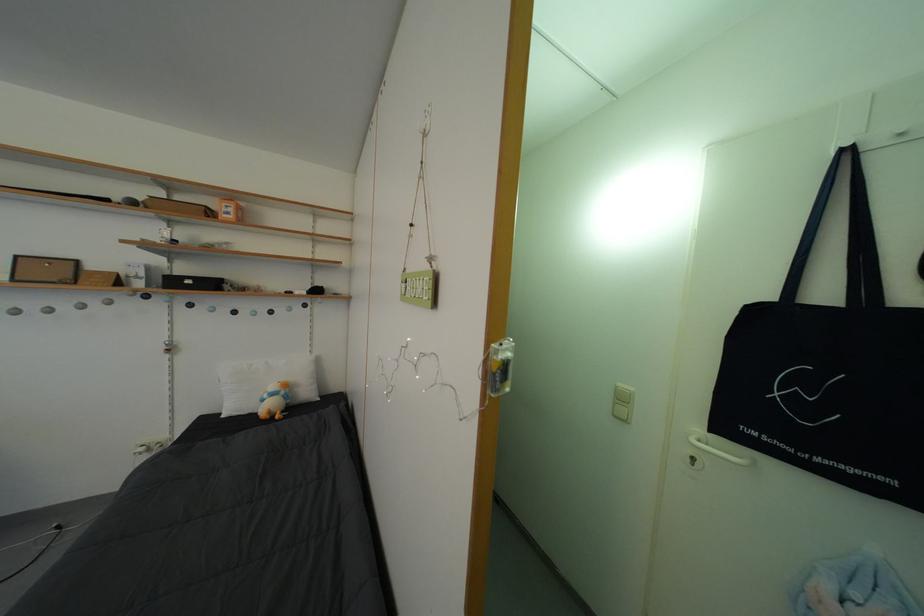
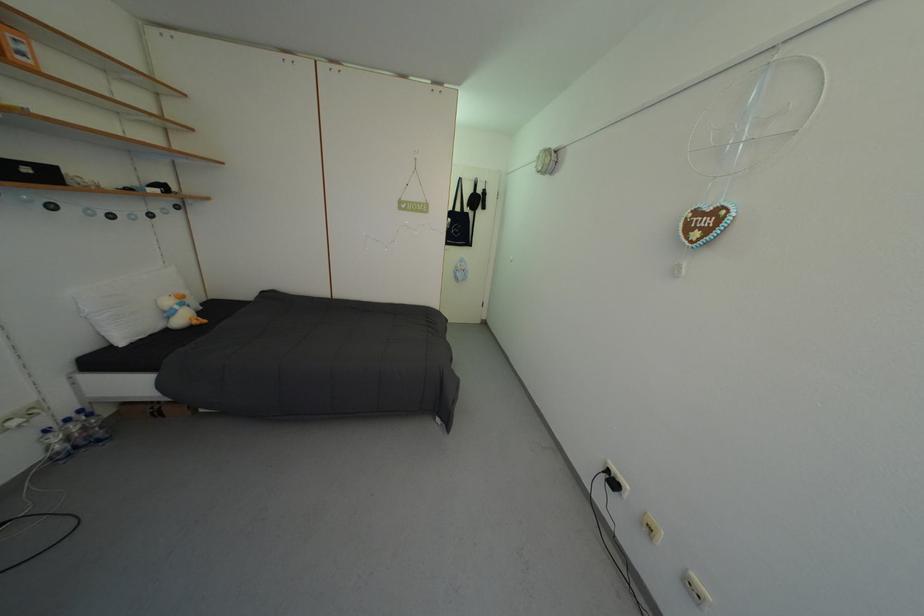
In the second image, find the point that corresponds to [274,400] in the first image.

(186, 313)